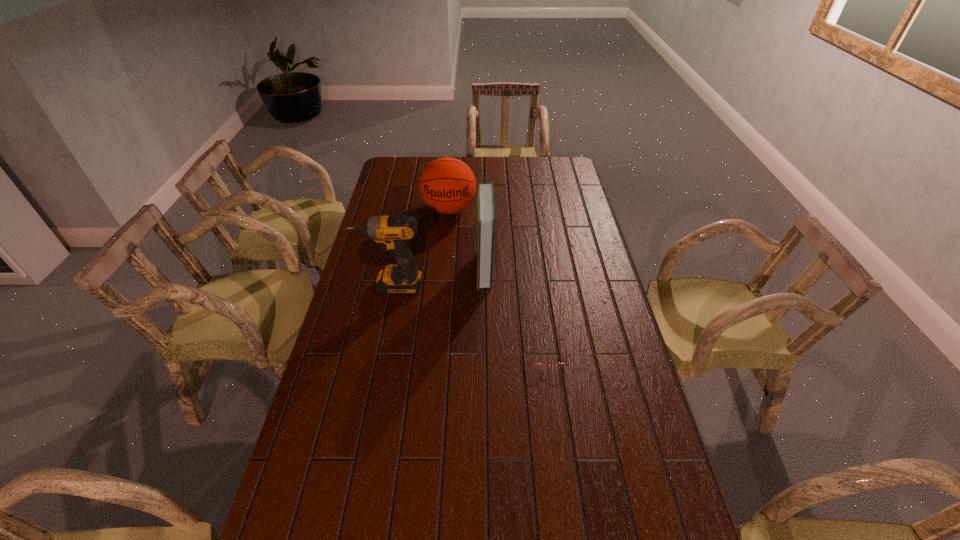
Where is `free region located 0.180m on the lenses of the rightmost object`? The height and width of the screenshot is (540, 960). free region located 0.180m on the lenses of the rightmost object is located at coordinates (555, 427).

The height and width of the screenshot is (540, 960). I want to click on object located in the left edge section of the desktop, so click(393, 232).

In the image, there is a desktop. At what (x,y) coordinates should I click in order to perform the action: click on vacant space at the far edge. Please return your answer as a coordinate pair (x, y). Looking at the image, I should click on (518, 158).

Find the location of a particular element. vacant space at the left edge of the desktop is located at coordinates (287, 502).

Find the location of a particular element. vacant point at the right edge is located at coordinates (576, 335).

This screenshot has height=540, width=960. In the image, there is a desktop. In order to click on free space at the far left corner in this screenshot , I will do `click(406, 167)`.

Find the location of a particular element. This screenshot has height=540, width=960. vacant area between the shortest object and the second object from right to left is located at coordinates (516, 312).

You are a GUI agent. You are given a task and a screenshot of the screen. Output one action in this format:
    pyautogui.click(x=<x>, y=<y>)
    Task: Click on the vacant area that lies between the drill and the farthest object
    This screenshot has height=540, width=960.
    Given the screenshot: What is the action you would take?
    pyautogui.click(x=420, y=247)

The height and width of the screenshot is (540, 960). Identify the location of free space between the rightmost object and the hardback book. (516, 312).

I want to click on vacant point located between the drill and the hardback book, so click(x=438, y=277).